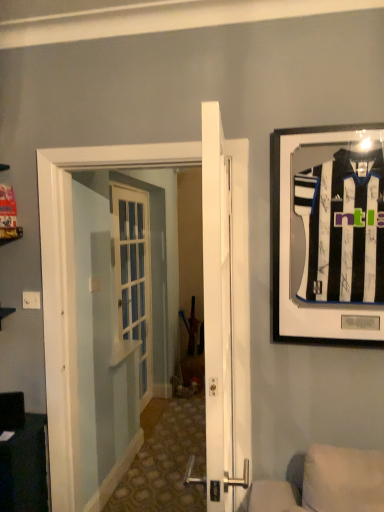
At what (x,y) coordinates should I click in order to perform the action: click on black matte jersey at upper right. Please return your answer as a coordinate pair (x, y). Looking at the image, I should click on (327, 234).

This screenshot has width=384, height=512. Describe the element at coordinates (327, 234) in the screenshot. I see `black matte jersey at upper right` at that location.

This screenshot has width=384, height=512. I want to click on black matte jersey at upper right, so click(327, 234).